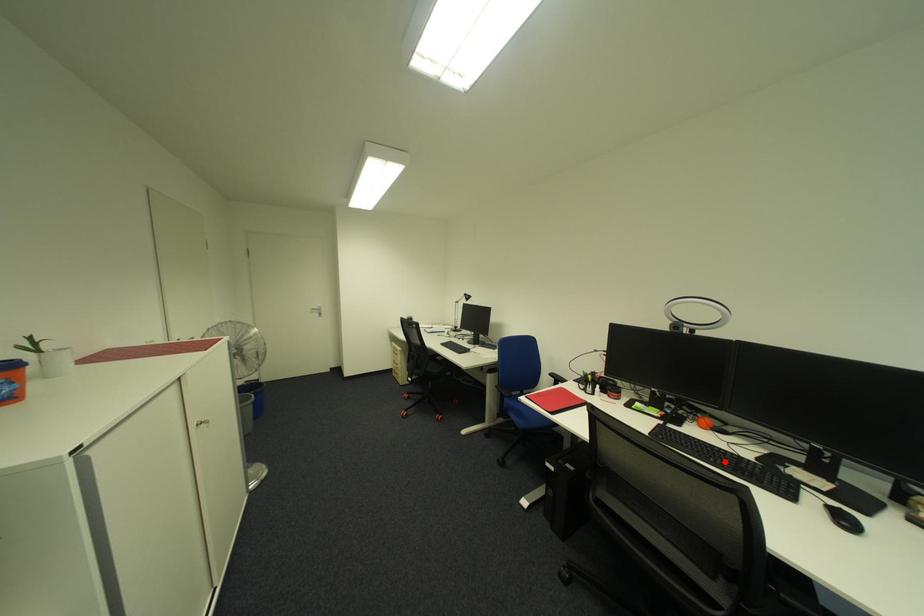
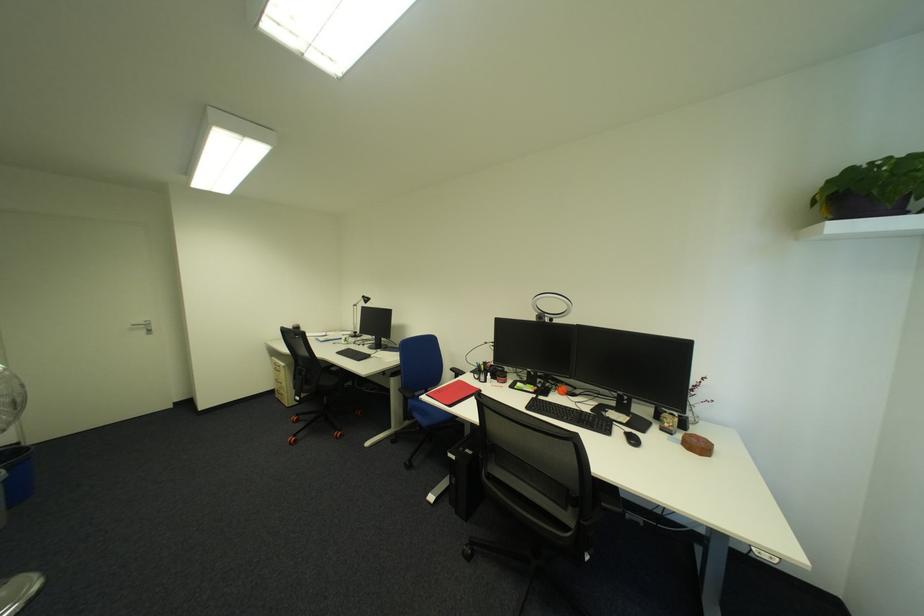
Where in the second image is the point corresponding to the highlighted location from the first image?

(577, 419)